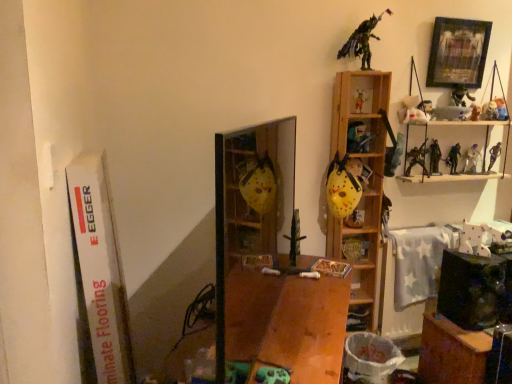
At what (x,y) coordinates should I click in order to perform the action: click on vacant area on top of wooden table at center (from a real-world perspective). Please return your answer as a coordinate pair (x, y). Looking at the image, I should click on (279, 305).